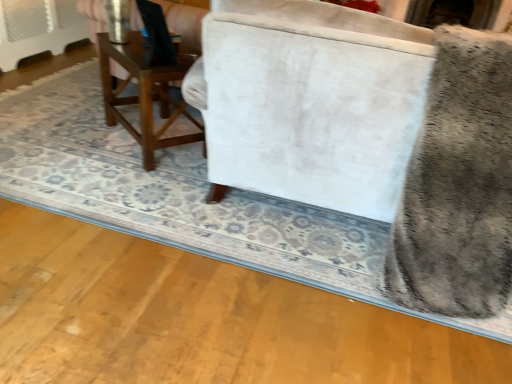
Question: Is gray plush swivel chair at right in front of or behind wooden table at center in the image?

Choices:
 (A) front
 (B) behind

Answer: (A)

Question: Is gray plush swivel chair at right spatially inside wooden table at center, or outside of it?

Choices:
 (A) inside
 (B) outside

Answer: (B)

Question: Considering the positions of gray plush swivel chair at right and wooden table at center in the image, is gray plush swivel chair at right wider or thinner than wooden table at center?

Choices:
 (A) wide
 (B) thin

Answer: (A)

Question: Is point (192, 142) positioned closer to the camera than point (483, 251)?

Choices:
 (A) farther
 (B) closer

Answer: (A)

Question: Would you say wooden table at center is to the left or to the right of gray plush swivel chair at right in the picture?

Choices:
 (A) right
 (B) left

Answer: (B)

Question: Is wooden table at center inside the boundaries of gray plush swivel chair at right, or outside?

Choices:
 (A) outside
 (B) inside

Answer: (A)

Question: Is wooden table at center bigger or smaller than gray plush swivel chair at right?

Choices:
 (A) big
 (B) small

Answer: (B)